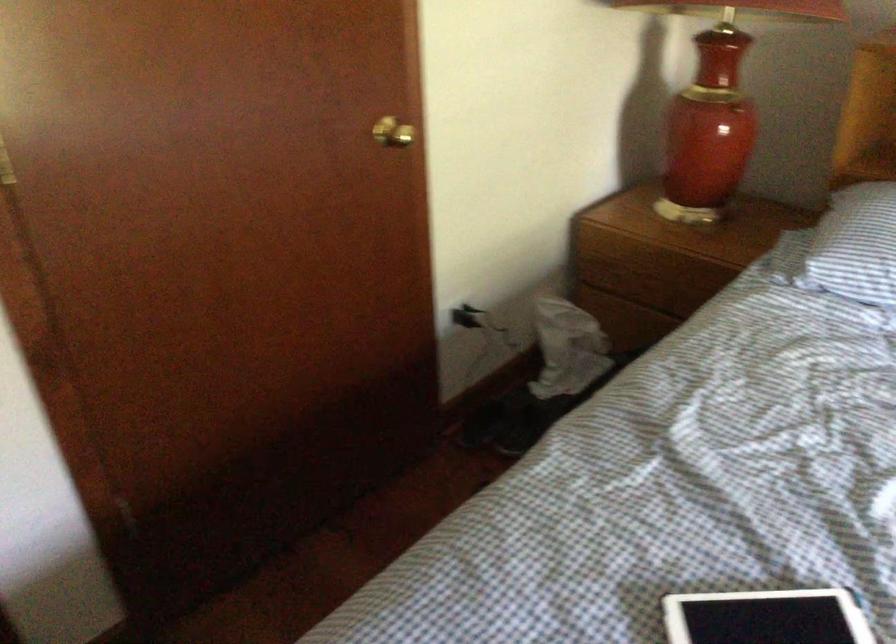
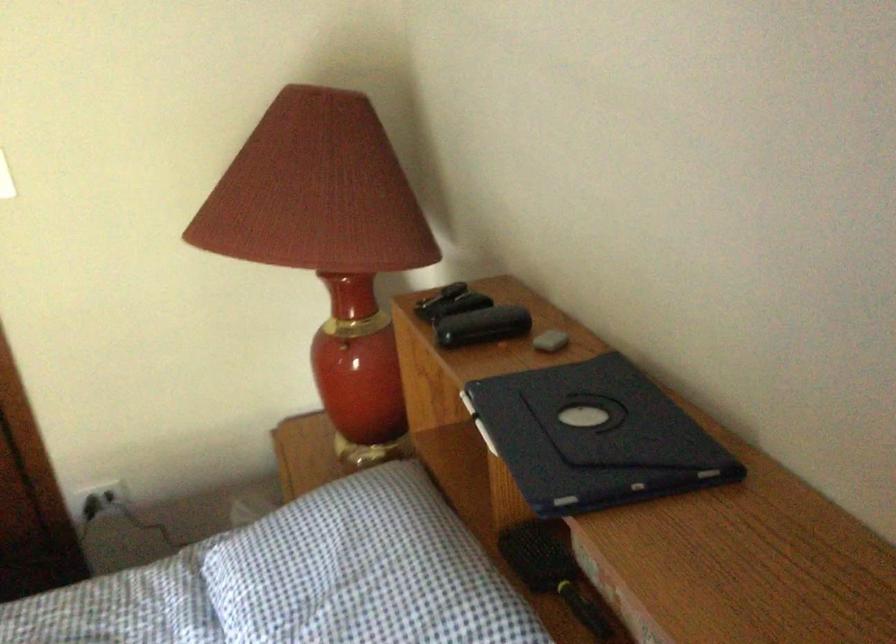
Question: Which direction would the cameraman need to move to produce the second image? Reply with the corresponding letter.

Choices:
 (A) Left
 (B) Right
 (C) Forward
 (D) Backward

Answer: (B)